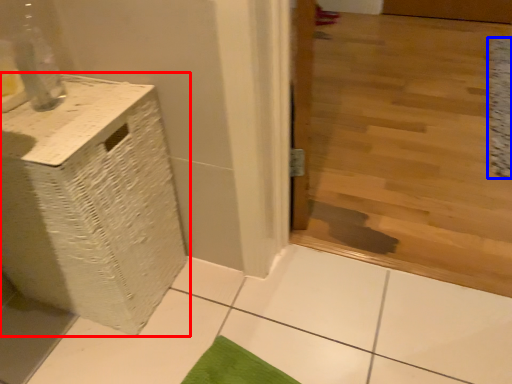
Question: Which object appears farthest to the camera in this image, furniture (highlighted by a red box) or mat (highlighted by a blue box)?

Choices:
 (A) furniture
 (B) mat

Answer: (B)